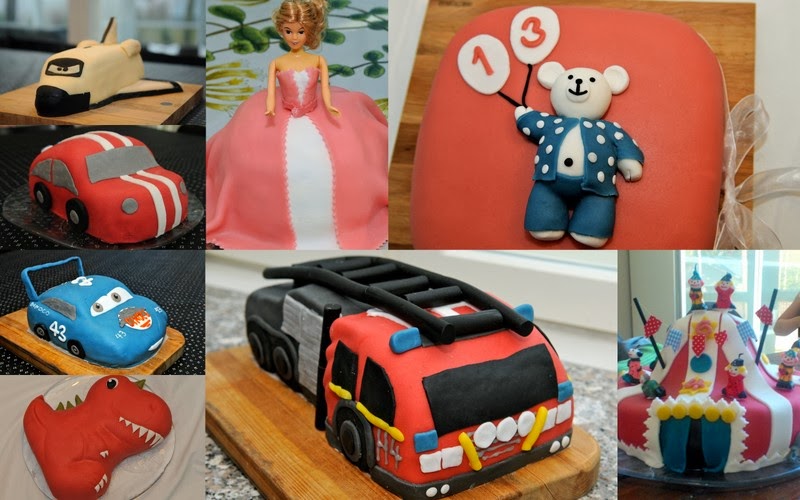
Where is `wooden table top`? The image size is (800, 500). wooden table top is located at coordinates (782, 496).